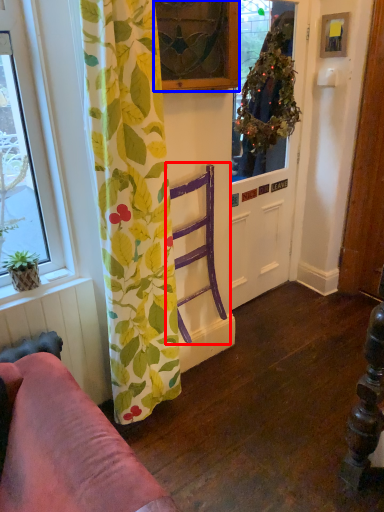
Question: Which of the following is the farthest to the observer, armchair (highlighted by a red box) or window (highlighted by a blue box)?

Choices:
 (A) armchair
 (B) window

Answer: (A)